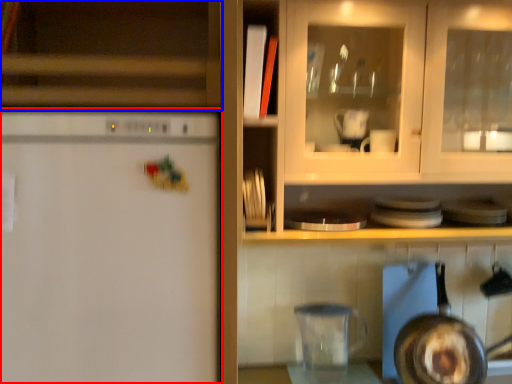
Question: Among these objects, which one is nearest to the camera, refrigerator (highlighted by a red box) or cabinetry (highlighted by a blue box)?

Choices:
 (A) refrigerator
 (B) cabinetry

Answer: (A)